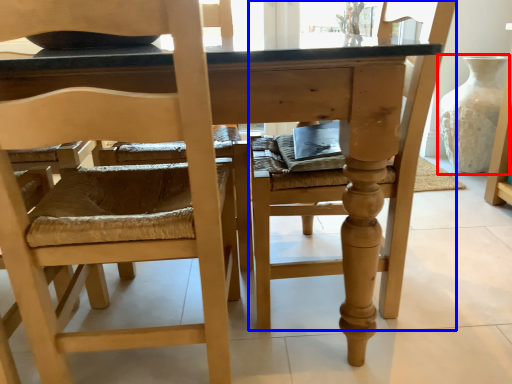
Question: Which of the following is the closest to the observer, glass vase (highlighted by a red box) or chair (highlighted by a blue box)?

Choices:
 (A) glass vase
 (B) chair

Answer: (B)